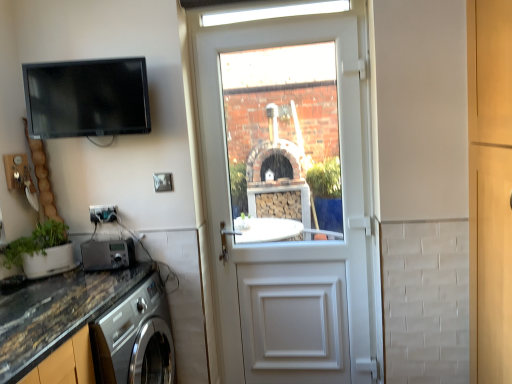
The height and width of the screenshot is (384, 512). What do you see at coordinates (283, 142) in the screenshot?
I see `white plastic door at center` at bounding box center [283, 142].

At what (x,y) coordinates should I click in order to perform the action: click on matte black electric outlet at lower left. Please return your answer as a coordinate pair (x, y). Looking at the image, I should click on (103, 213).

Measure the distance between point (x=123, y=63) and camera.

Point (x=123, y=63) and camera are 6.46 feet apart.

The height and width of the screenshot is (384, 512). What are the coordinates of `marble-like granite countertop at lower left` in the screenshot? It's located at (55, 313).

What do you see at coordinates (42, 251) in the screenshot? The width and height of the screenshot is (512, 384). I see `green matte plant at lower left` at bounding box center [42, 251].

Locate an element on the screen. white plastic door at center is located at coordinates (283, 142).

Measure the distance between white plastic door at center and marble-like granite countertop at lower left.

white plastic door at center and marble-like granite countertop at lower left are 36.53 inches apart from each other.

Is point (274, 173) closer or farther from the camera than point (48, 331)?

Point (274, 173) is positioned farther from the camera compared to point (48, 331).

From the image's perspective, is white plastic door at center positioned above or below marble-like granite countertop at lower left?

white plastic door at center is situated higher than marble-like granite countertop at lower left in the image.

Considering the sizes of objects white plastic door at center and marble-like granite countertop at lower left in the image provided, who is taller, white plastic door at center or marble-like granite countertop at lower left?

white plastic door at center is taller.

Considering the points (64, 124) and (42, 227), which point is behind, point (64, 124) or point (42, 227)?

The point (42, 227) is behind.

Considering the relative sizes of matte black tv at upper left, which is counted as the 1th appliance, starting from the top, and green matte plant at lower left in the image provided, is matte black tv at upper left, which is counted as the 1th appliance, starting from the top, shorter than green matte plant at lower left?

Incorrect, the height of matte black tv at upper left, which is counted as the 1th appliance, starting from the top, does not fall short of that of green matte plant at lower left.

How far apart are matte black tv at upper left, which is counted as the 1th appliance, starting from the top, and green matte plant at lower left?

The distance of matte black tv at upper left, which is counted as the 1th appliance, starting from the top, from green matte plant at lower left is 24.95 inches.

Are matte black tv at upper left, which is counted as the 1th appliance, starting from the top, and green matte plant at lower left located far from each other?

matte black tv at upper left, which is counted as the 1th appliance, starting from the top, is near green matte plant at lower left, not far away.

From the image's perspective, who appears lower, marble-like granite countertop at lower left or metallic silver radio at lower left, marked as the second appliance in a top-to-bottom arrangement?

marble-like granite countertop at lower left, from the image's perspective.

Does point (20, 330) come closer to viewer compared to point (115, 259)?

Yes, it is in front of point (115, 259).

Is marble-like granite countertop at lower left situated inside metallic silver radio at lower left, placed as the 1th appliance when sorted from bottom to top, or outside?

marble-like granite countertop at lower left cannot be found inside metallic silver radio at lower left, placed as the 1th appliance when sorted from bottom to top.

In terms of height, does marble-like granite countertop at lower left look taller or shorter compared to metallic silver radio at lower left, marked as the second appliance in a top-to-bottom arrangement?

marble-like granite countertop at lower left is taller than metallic silver radio at lower left, marked as the second appliance in a top-to-bottom arrangement.

From a real-world perspective, is matte black electric outlet at lower left above or below metallic silver radio at lower left, marked as the second appliance in a top-to-bottom arrangement?

In terms of real-world spatial position, matte black electric outlet at lower left is above metallic silver radio at lower left, marked as the second appliance in a top-to-bottom arrangement.

How different are the orientations of matte black electric outlet at lower left and metallic silver radio at lower left, placed as the 1th appliance when sorted from bottom to top, in degrees?

They differ by 0.00235 degrees in their facing directions.

Between point (90, 208) and point (92, 258), which one is positioned in front?

Point (92, 258)

From the image's perspective, is matte black electric outlet at lower left above or below metallic silver radio at lower left, placed as the 1th appliance when sorted from bottom to top?

Based on their image positions, matte black electric outlet at lower left is located above metallic silver radio at lower left, placed as the 1th appliance when sorted from bottom to top.

Which object is positioned more to the left, green matte plant at lower left or metallic silver radio at lower left, placed as the 1th appliance when sorted from bottom to top?

green matte plant at lower left is more to the left.

Is green matte plant at lower left wider than metallic silver radio at lower left, placed as the 1th appliance when sorted from bottom to top?

Correct, the width of green matte plant at lower left exceeds that of metallic silver radio at lower left, placed as the 1th appliance when sorted from bottom to top.

Which is farther, (62, 255) or (109, 249)?

Point (62, 255)

Is green matte plant at lower left taller or shorter than metallic silver radio at lower left, placed as the 1th appliance when sorted from bottom to top?

In the image, green matte plant at lower left appears to be taller than metallic silver radio at lower left, placed as the 1th appliance when sorted from bottom to top.

Which appliance is the 1st one when counting from the back of the marble-like granite countertop at lower left? Please provide its 2D coordinates.

[(87, 98)]

Considering the relative positions of marble-like granite countertop at lower left and matte black tv at upper left, the 2th appliance positioned from the bottom, in the image provided, is marble-like granite countertop at lower left to the right of matte black tv at upper left, the 2th appliance positioned from the bottom, from the viewer's perspective?

Yes, marble-like granite countertop at lower left is to the right of matte black tv at upper left, the 2th appliance positioned from the bottom.

Between marble-like granite countertop at lower left and matte black tv at upper left, which is counted as the 1th appliance, starting from the top, which one has smaller width?

matte black tv at upper left, which is counted as the 1th appliance, starting from the top.

Considering the sizes of objects matte black electric outlet at lower left and marble-like granite countertop at lower left in the image provided, who is thinner, matte black electric outlet at lower left or marble-like granite countertop at lower left?

With smaller width is matte black electric outlet at lower left.

Are matte black electric outlet at lower left and marble-like granite countertop at lower left making contact?

matte black electric outlet at lower left is not next to marble-like granite countertop at lower left, and they're not touching.

You are a GUI agent. You are given a task and a screenshot of the screen. Output one action in this format:
    pyautogui.click(x=<x>, y=<y>)
    Task: Click on the countertop below the matte black electric outlet at lower left (from a real-world perspective)
    The height and width of the screenshot is (384, 512).
    Given the screenshot: What is the action you would take?
    pyautogui.click(x=55, y=313)

Is matte black electric outlet at lower left oriented away from marble-like granite countertop at lower left?

No, marble-like granite countertop at lower left is not at the back of matte black electric outlet at lower left.

Image resolution: width=512 pixels, height=384 pixels. I want to click on countertop to the left of white plastic door at center, so click(55, 313).

This screenshot has width=512, height=384. What are the coordinates of `the 1st appliance behind the green matte plant at lower left` in the screenshot? It's located at (87, 98).

When comparing their distances from marble-like granite countertop at lower left, does matte black electric outlet at lower left or metallic silver radio at lower left, placed as the 1th appliance when sorted from bottom to top, seem closer?

metallic silver radio at lower left, placed as the 1th appliance when sorted from bottom to top, is positioned closer to the anchor marble-like granite countertop at lower left.

When comparing their distances from marble-like granite countertop at lower left, does matte black tv at upper left, which is counted as the 1th appliance, starting from the top, or white plastic door at center seem closer?

matte black tv at upper left, which is counted as the 1th appliance, starting from the top.

Considering their positions, is matte black tv at upper left, which is counted as the 1th appliance, starting from the top, positioned closer to metallic silver radio at lower left, marked as the second appliance in a top-to-bottom arrangement, than white plastic door at center?

Among the two, matte black tv at upper left, which is counted as the 1th appliance, starting from the top, is located nearer to metallic silver radio at lower left, marked as the second appliance in a top-to-bottom arrangement.

When comparing their distances from metallic silver radio at lower left, placed as the 1th appliance when sorted from bottom to top, does matte black electric outlet at lower left or matte black tv at upper left, which is counted as the 1th appliance, starting from the top, seem closer?

matte black electric outlet at lower left lies closer to metallic silver radio at lower left, placed as the 1th appliance when sorted from bottom to top, than the other object.

From the image, which object appears to be farther from matte black tv at upper left, the 2th appliance positioned from the bottom, metallic silver radio at lower left, placed as the 1th appliance when sorted from bottom to top, or matte black electric outlet at lower left?

metallic silver radio at lower left, placed as the 1th appliance when sorted from bottom to top.

Considering their positions, is matte black electric outlet at lower left positioned further to green matte plant at lower left than marble-like granite countertop at lower left?

Among the two, marble-like granite countertop at lower left is located further to green matte plant at lower left.

Looking at the image, which one is located further to matte black tv at upper left, which is counted as the 1th appliance, starting from the top, matte black electric outlet at lower left or green matte plant at lower left?

The object further to matte black tv at upper left, which is counted as the 1th appliance, starting from the top, is green matte plant at lower left.

Estimate the real-world distances between objects in this image. Which object is closer to matte black tv at upper left, the 2th appliance positioned from the bottom, metallic silver radio at lower left, placed as the 1th appliance when sorted from bottom to top, or white plastic door at center?

metallic silver radio at lower left, placed as the 1th appliance when sorted from bottom to top, lies closer to matte black tv at upper left, the 2th appliance positioned from the bottom, than the other object.

Find the location of a particular element. houseplant that lies between matte black electric outlet at lower left and marble-like granite countertop at lower left from top to bottom is located at coordinates (42, 251).

What are the coordinates of `electric outlet between green matte plant at lower left and white plastic door at center` in the screenshot? It's located at (103, 213).

Where is `appliance between matte black tv at upper left, which is counted as the 1th appliance, starting from the top, and white plastic door at center`? The height and width of the screenshot is (384, 512). appliance between matte black tv at upper left, which is counted as the 1th appliance, starting from the top, and white plastic door at center is located at coordinates (106, 254).

Identify the location of countertop between green matte plant at lower left and white plastic door at center in the horizontal direction. The height and width of the screenshot is (384, 512). (55, 313).